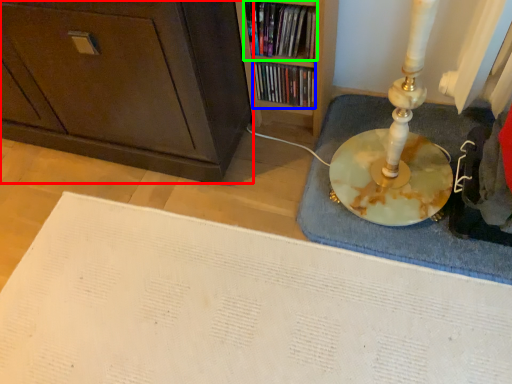
Question: Considering the real-world distances, which object is farthest from cabinetry (highlighted by a red box)? book (highlighted by a blue box) or book (highlighted by a green box)?

Choices:
 (A) book
 (B) book

Answer: (A)